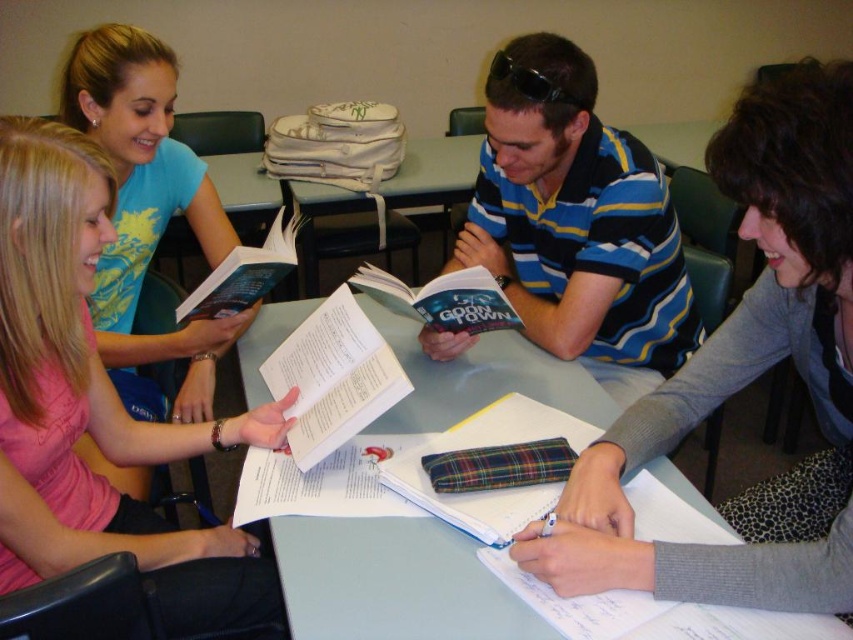
Question: Which object is the farthest from the hardcover book at center?

Choices:
 (A) pink fabric shirt at upper left
 (B) hardcover book at upper left

Answer: (A)

Question: Does hardcover book at center have a larger size compared to hardcover book at upper left?

Choices:
 (A) no
 (B) yes

Answer: (A)

Question: Which of the following is the farthest from the observer?

Choices:
 (A) plaid fabric notebook at center
 (B) gray sweater at center

Answer: (A)

Question: Is gray sweater at center wider than hardcover book at center?

Choices:
 (A) no
 (B) yes

Answer: (B)

Question: Is light gray plastic table at center positioned behind white paper book at center?

Choices:
 (A) yes
 (B) no

Answer: (B)

Question: Estimate the real-world distances between objects in this image. Which object is farther from the striped cotton shirt at center?

Choices:
 (A) light gray plastic table at center
 (B) plaid fabric notebook at center
 (C) hardcover book at upper left

Answer: (C)